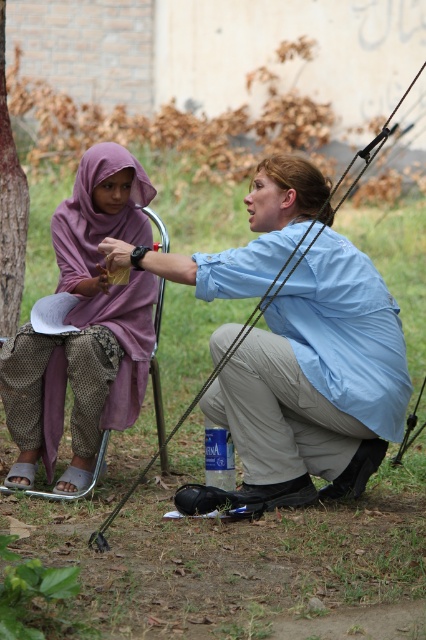
Describe the element at coordinates (311, 385) in the screenshot. The image size is (426, 640). I see `blue cotton shirt at center` at that location.

The width and height of the screenshot is (426, 640). Find the location of `blue cotton shirt at center`. blue cotton shirt at center is located at coordinates (311, 385).

In the scene shown: Does purple fabric hijab at left have a smaller size compared to brown rough bark at left?

Actually, purple fabric hijab at left might be larger than brown rough bark at left.

Between purple fabric hijab at left and brown rough bark at left, which one has more height?

With more height is brown rough bark at left.

Is point (66, 205) positioned before point (2, 54)?

Yes, point (66, 205) is closer to viewer.

The height and width of the screenshot is (640, 426). I want to click on purple fabric hijab at left, so (83, 326).

Is blue cotton shirt at center shorter than brown rough bark at left?

Yes.

Is point (273, 460) closer to camera compared to point (20, 170)?

Yes, it is.

Locate an element on the screen. The height and width of the screenshot is (640, 426). blue cotton shirt at center is located at coordinates (311, 385).